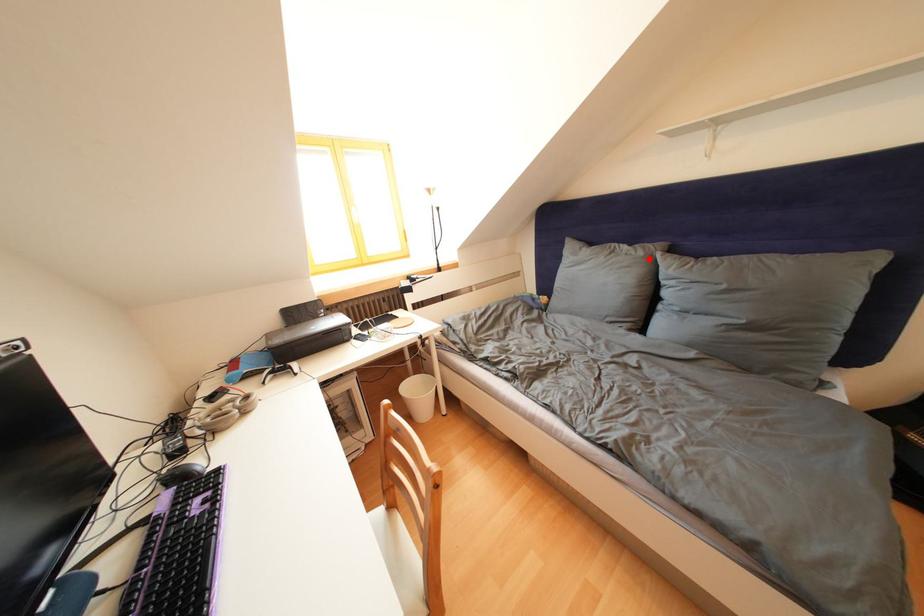
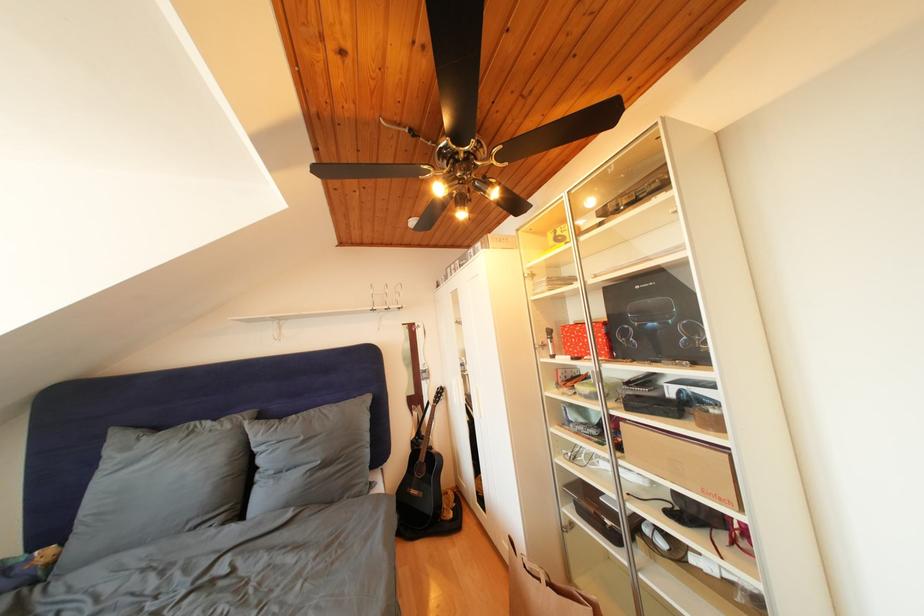
Find the pixel in the second image that matches the highlighted location in the first image.

(236, 432)